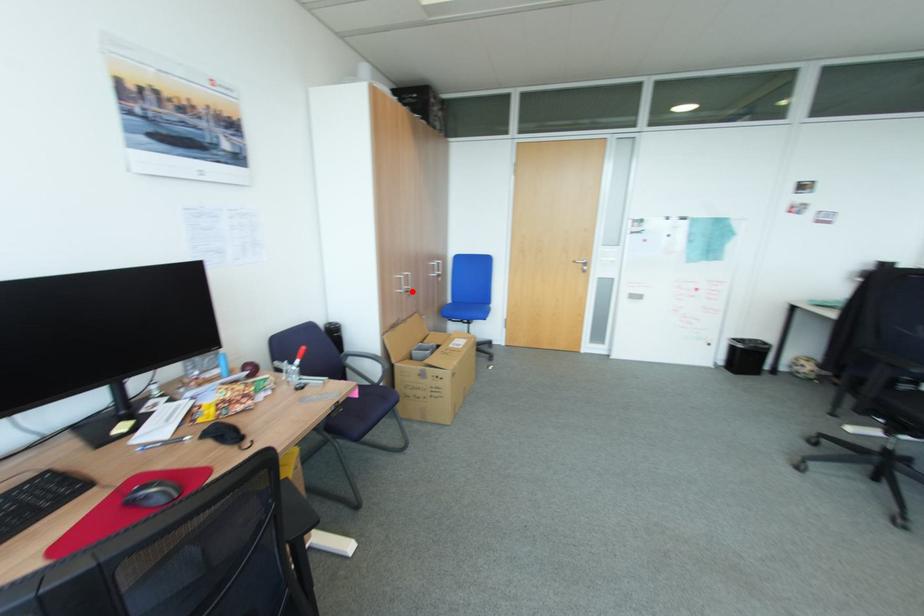
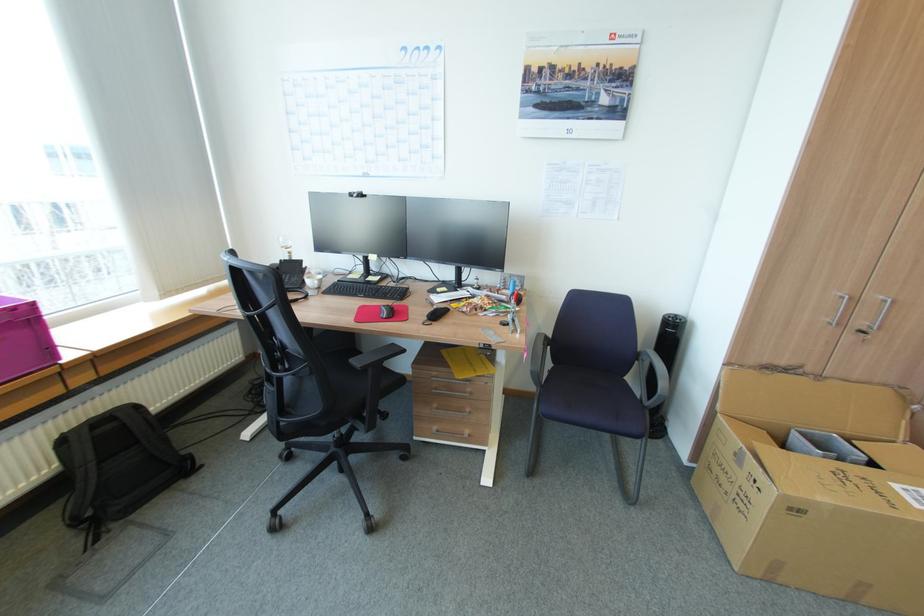
In the second image, find the point that corresponds to the highlighted location in the first image.

(868, 331)